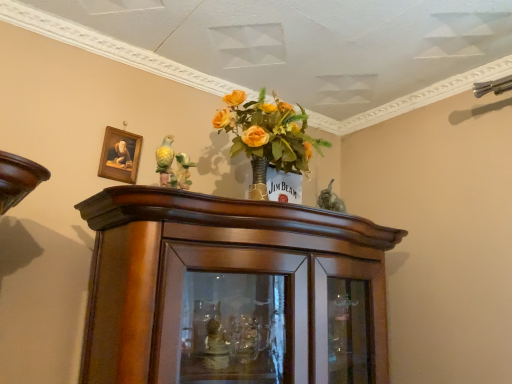
Question: Should I look upward or downward to see wooden frame at upper left?

Choices:
 (A) up
 (B) down

Answer: (A)